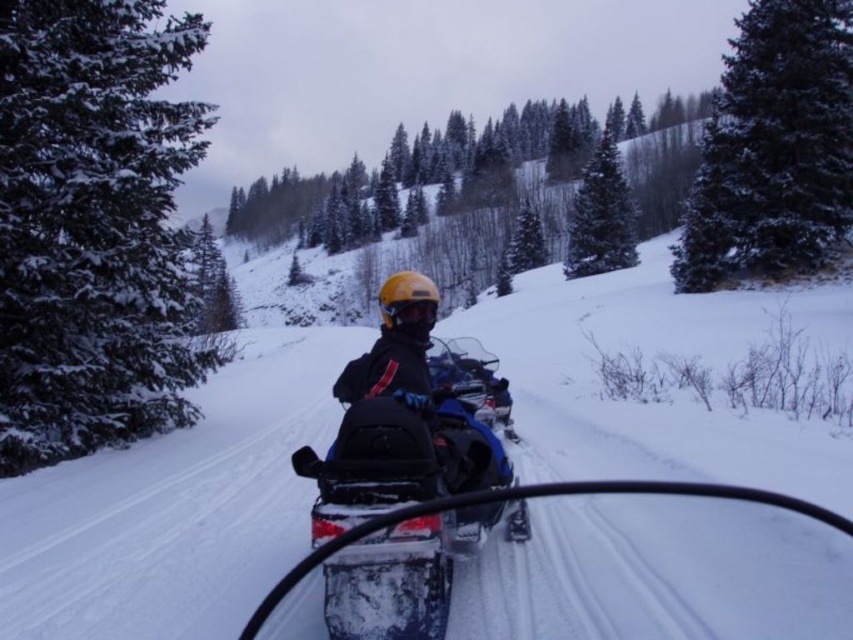
You are riding a snowmobile and notice two trees in the distance. The snowy evergreen tree at upper right and the green matte pine at upper center. Which tree would appear closer to you based on their positions?

The snowy evergreen tree at upper right is in front of the green matte pine at upper center, so it would appear closer to you.

You are riding a snowmobile and want to navigate around the green matte pine at upper center while staying on the path. Which direction should you turn to keep the blue matte snowmobile at center in your line of sight?

You should turn to the right to keep the blue matte snowmobile at center in your line of sight since it is positioned on the left side of the green matte pine at upper center.

You are riding a snowmobile and need to navigate through the snowy forest. There is a blue matte snowmobile at center and a snowy evergreen tree at upper right in your view. Which object is closer to you based on their positions?

The blue matte snowmobile at center is closer to you than the snowy evergreen tree at upper right because it is positioned in the center of your view, while the tree is located at the upper right, which is farther away.